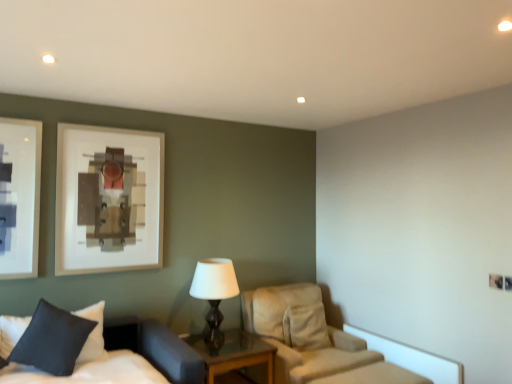
Question: Is dark blue fabric pillow at lower left to the right of wooden glass top nightstand at center from the viewer's perspective?

Choices:
 (A) yes
 (B) no

Answer: (B)

Question: Is dark blue fabric pillow at lower left wider than wooden glass top nightstand at center?

Choices:
 (A) yes
 (B) no

Answer: (B)

Question: Does dark blue fabric pillow at lower left have a lesser width compared to wooden glass top nightstand at center?

Choices:
 (A) yes
 (B) no

Answer: (A)

Question: From the image's perspective, is dark blue fabric pillow at lower left located above wooden glass top nightstand at center?

Choices:
 (A) no
 (B) yes

Answer: (B)

Question: From a real-world perspective, does dark blue fabric pillow at lower left stand above wooden glass top nightstand at center?

Choices:
 (A) no
 (B) yes

Answer: (B)

Question: From a real-world perspective, is white soft bed at lower left physically located above or below dark blue fabric pillow at lower left?

Choices:
 (A) below
 (B) above

Answer: (A)

Question: Is white soft bed at lower left bigger or smaller than dark blue fabric pillow at lower left?

Choices:
 (A) small
 (B) big

Answer: (B)

Question: From the image's perspective, is white soft bed at lower left positioned above or below dark blue fabric pillow at lower left?

Choices:
 (A) below
 (B) above

Answer: (A)

Question: Considering the positions of white soft bed at lower left and dark blue fabric pillow at lower left in the image, is white soft bed at lower left taller or shorter than dark blue fabric pillow at lower left?

Choices:
 (A) tall
 (B) short

Answer: (A)

Question: Does point (325, 337) appear closer or farther from the camera than point (237, 332)?

Choices:
 (A) farther
 (B) closer

Answer: (B)

Question: From the image's perspective, is beige fabric chair at center above or below wooden glass top nightstand at center?

Choices:
 (A) below
 (B) above

Answer: (B)

Question: From their relative heights in the image, would you say beige fabric chair at center is taller or shorter than wooden glass top nightstand at center?

Choices:
 (A) short
 (B) tall

Answer: (B)

Question: Relative to wooden glass top nightstand at center, is beige fabric chair at center in front or behind?

Choices:
 (A) behind
 (B) front

Answer: (A)

Question: From the image's perspective, is dark blue fabric pillow at lower left above or below white soft bed at lower left?

Choices:
 (A) below
 (B) above

Answer: (B)

Question: Considering the positions of dark blue fabric pillow at lower left and white soft bed at lower left in the image, is dark blue fabric pillow at lower left taller or shorter than white soft bed at lower left?

Choices:
 (A) short
 (B) tall

Answer: (A)